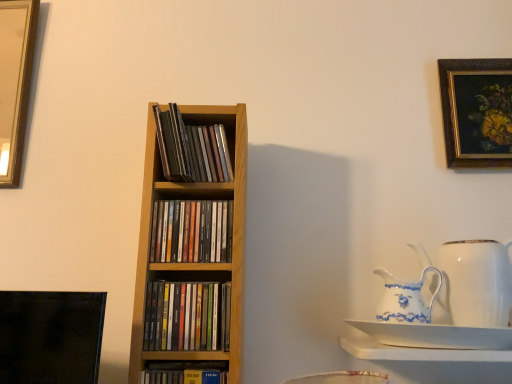
Question: Considering the relative sizes of wooden cd case at center, the first book from the top, and white porcelain jug at right, the second jug viewed from the left, in the image provided, is wooden cd case at center, the first book from the top, smaller than white porcelain jug at right, the second jug viewed from the left,?

Choices:
 (A) yes
 (B) no

Answer: (A)

Question: Could white porcelain jug at right, which is the 1th jug from right to left, be considered to be inside wooden cd case at center, the first book from the top?

Choices:
 (A) no
 (B) yes

Answer: (A)

Question: Is wooden cd case at center, the fourth book ordered from the bottom, further to camera compared to white porcelain jug at right, which is the 1th jug from right to left?

Choices:
 (A) no
 (B) yes

Answer: (B)

Question: Is wooden cd case at center, the fourth book ordered from the bottom, positioned in front of white porcelain jug at right, the second jug viewed from the left?

Choices:
 (A) no
 (B) yes

Answer: (A)

Question: Can you confirm if wooden cd case at center, the fourth book ordered from the bottom, is wider than white porcelain jug at right, which is the 1th jug from right to left?

Choices:
 (A) no
 (B) yes

Answer: (A)

Question: In terms of size, does gold-framed painting at upper right appear bigger or smaller than white glossy shelf at lower right?

Choices:
 (A) small
 (B) big

Answer: (A)

Question: Is gold-framed painting at upper right wider or thinner than white glossy shelf at lower right?

Choices:
 (A) thin
 (B) wide

Answer: (A)

Question: Would you say gold-framed painting at upper right is to the left or to the right of white glossy shelf at lower right in the picture?

Choices:
 (A) right
 (B) left

Answer: (A)

Question: From a real-world perspective, is gold-framed painting at upper right physically located above or below white glossy shelf at lower right?

Choices:
 (A) above
 (B) below

Answer: (A)

Question: Considering the positions of white porcelain jug at right, which is the 1th jug from right to left, and white porcelain jug at right, the 1th jug when ordered from left to right, in the image, is white porcelain jug at right, which is the 1th jug from right to left, bigger or smaller than white porcelain jug at right, the 1th jug when ordered from left to right,?

Choices:
 (A) big
 (B) small

Answer: (A)

Question: From the image's perspective, is white porcelain jug at right, the second jug viewed from the left, located above or below white porcelain jug at right, the 1th jug when ordered from left to right?

Choices:
 (A) below
 (B) above

Answer: (B)

Question: Considering their positions, is white porcelain jug at right, the second jug viewed from the left, located in front of or behind white porcelain jug at right, the 1th jug when ordered from left to right?

Choices:
 (A) behind
 (B) front

Answer: (A)

Question: Does point (462, 304) appear closer or farther from the camera than point (402, 288)?

Choices:
 (A) farther
 (B) closer

Answer: (A)

Question: From the image's perspective, relative to multicolored paper books at center, positioned as the second book in bottom-to-top order, is white porcelain jug at right, the second jug viewed from the left, above or below?

Choices:
 (A) above
 (B) below

Answer: (A)

Question: Considering the positions of white porcelain jug at right, which is the 1th jug from right to left, and multicolored paper books at center, which is the 3th book in top-to-bottom order, in the image, is white porcelain jug at right, which is the 1th jug from right to left, wider or thinner than multicolored paper books at center, which is the 3th book in top-to-bottom order,?

Choices:
 (A) thin
 (B) wide

Answer: (B)